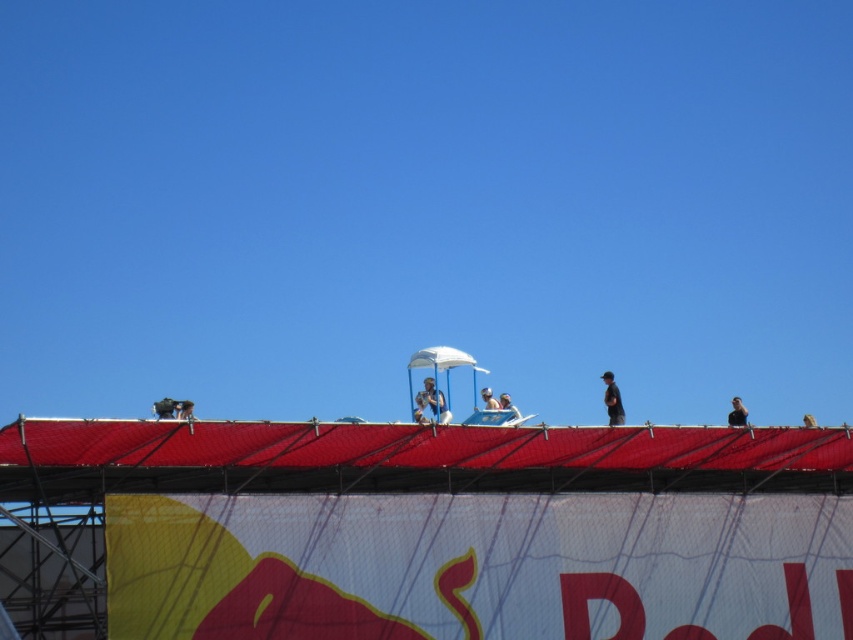
Can you confirm if white fabric umbrella at upper center is wider than matte black helmet at upper center?

Incorrect, white fabric umbrella at upper center's width does not surpass matte black helmet at upper center's.

From the picture: Can you confirm if white fabric umbrella at upper center is smaller than matte black helmet at upper center?

Correct, white fabric umbrella at upper center occupies less space than matte black helmet at upper center.

Image resolution: width=853 pixels, height=640 pixels. What do you see at coordinates (508, 404) in the screenshot? I see `white fabric umbrella at upper center` at bounding box center [508, 404].

In order to click on white fabric umbrella at upper center in this screenshot , I will do `click(508, 404)`.

Consider the image. Is black matte person at upper right positioned before light blue fabric umbrella at center?

No, it is behind light blue fabric umbrella at center.

Which is behind, point (732, 420) or point (422, 392)?

The point (422, 392) is behind.

What do you see at coordinates (737, 413) in the screenshot?
I see `black matte person at upper right` at bounding box center [737, 413].

I want to click on black matte person at upper right, so click(737, 413).

Can you confirm if red fabric roof at upper center is thinner than matte black helmet at upper center?

No, red fabric roof at upper center is not thinner than matte black helmet at upper center.

Between point (207, 444) and point (805, 419), which one is positioned behind?

The point (805, 419) is behind.

The height and width of the screenshot is (640, 853). What are the coordinates of `red fabric roof at upper center` in the screenshot? It's located at (418, 445).